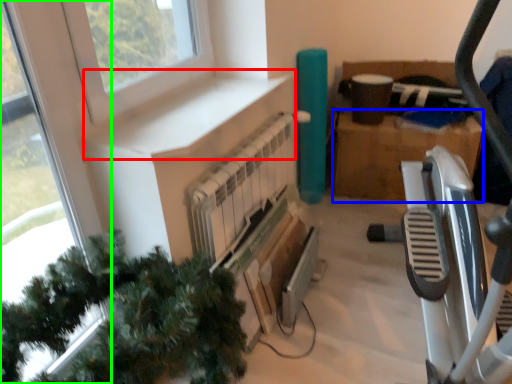
Question: Based on their relative distances, which object is nearer to window sill (highlighted by a red box)? Choose from cardboard box (highlighted by a blue box) and window (highlighted by a green box).

Choices:
 (A) cardboard box
 (B) window

Answer: (B)